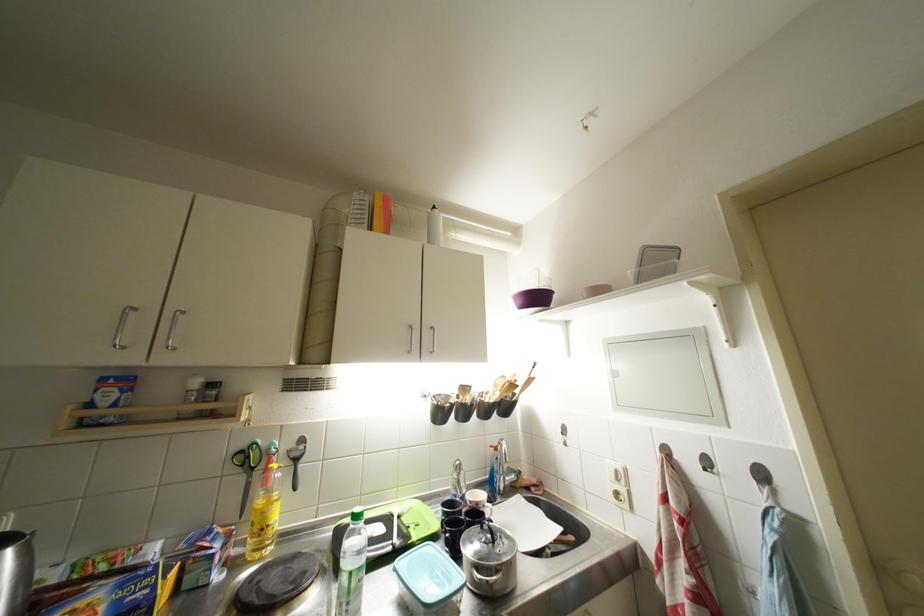
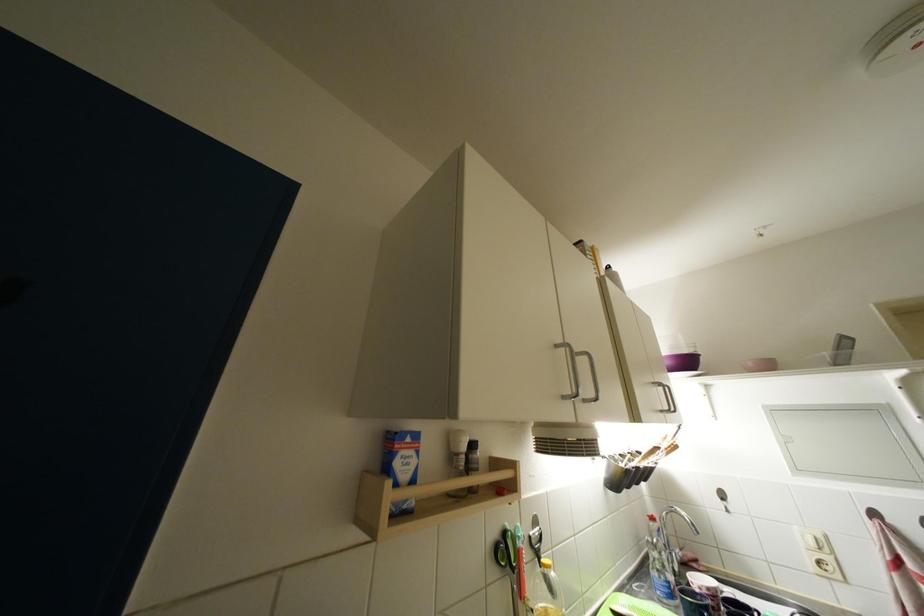
Question: Which direction would the cameraman need to move to produce the second image? Reply with the corresponding letter.

Choices:
 (A) Left
 (B) Right
 (C) Forward
 (D) Backward

Answer: (A)